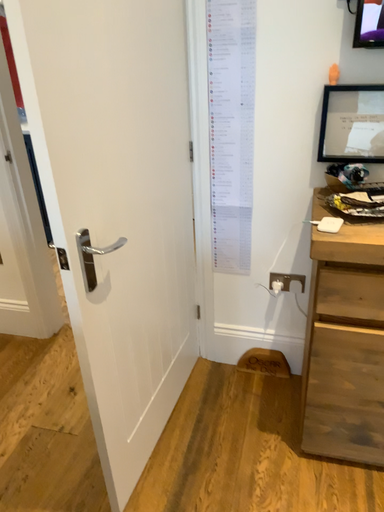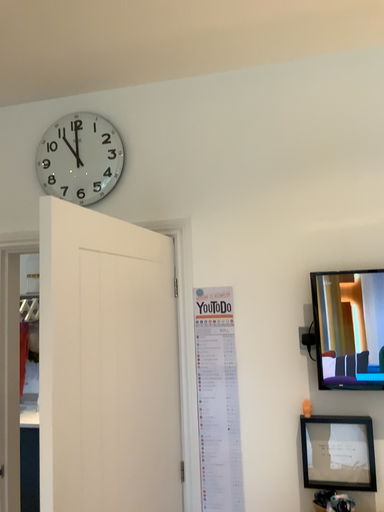
Question: Which way did the camera rotate in the video?

Choices:
 (A) rotated upward
 (B) rotated downward

Answer: (A)